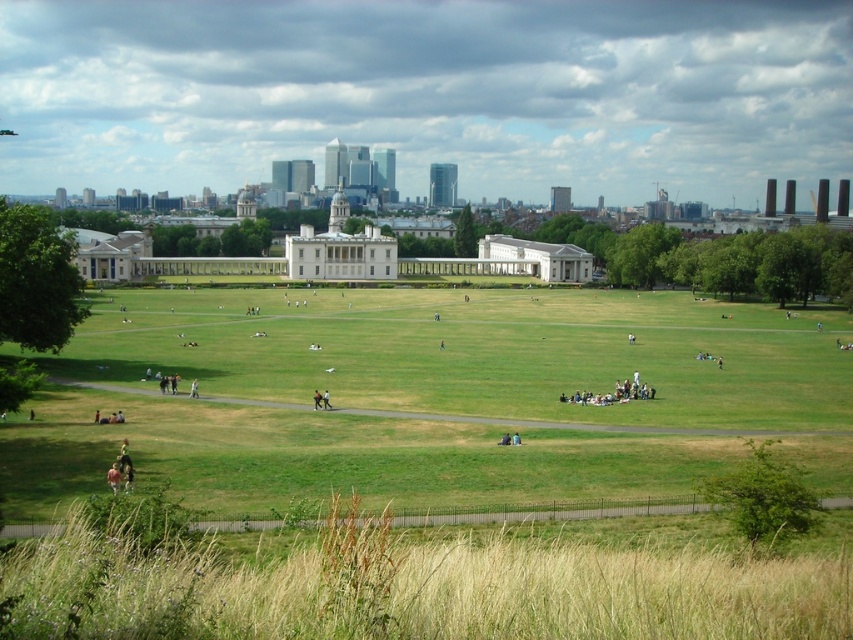
You are a photographer planning to take a portrait in the park. You want to ensure the subject wearing dark blue jeans at center stands out against the green grass at center. Based on the scene description, will the height difference between the two help in achieving this effect?

The green grass at center is taller than dark blue jeans at center, so the grass may obscure the jeans, making it harder for the subject to stand out. Consider trimming the grass or choosing a different location with shorter grass for better visibility.

You are a tourist visiting the park and want to take a photo of the light brown wooden bench at center without any obstructions. Can you move to a position where the transparent glass skyscrapers at center won

The light brown wooden bench at center is behind the transparent glass skyscrapers at center, so you can move to a position behind the transparent glass skyscrapers at center to take a photo of the bench without obstructions.

You are planning to take a photo of the transparent glass skyscrapers at center and the light brown wooden bench at center from a distance. Which object will occupy more space in your photo?

The transparent glass skyscrapers at center will occupy more space in the photo because their width is larger than the light brown wooden bench at center.